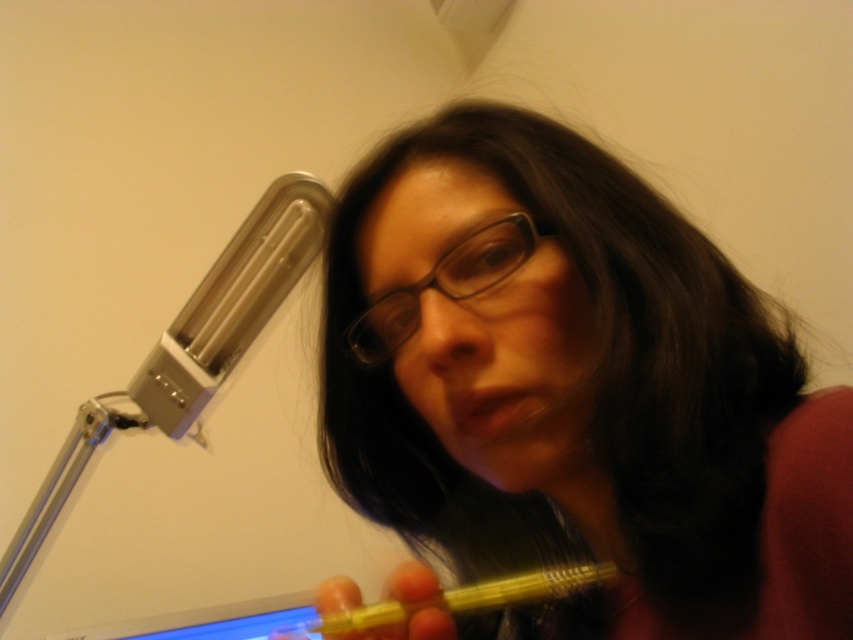
Question: From the image, what is the correct spatial relationship of translucent yellow pen at center in relation to transparent plastic glasses at center?

Choices:
 (A) right
 (B) left

Answer: (A)

Question: Is translucent yellow pen at center to the right of transparent plastic glasses at center from the viewer's perspective?

Choices:
 (A) yes
 (B) no

Answer: (A)

Question: Can you confirm if translucent yellow pen at center is positioned below transparent plastic glasses at center?

Choices:
 (A) no
 (B) yes

Answer: (B)

Question: Which object is closer to the camera taking this photo?

Choices:
 (A) transparent plastic glasses at center
 (B) translucent yellow pen at center

Answer: (B)